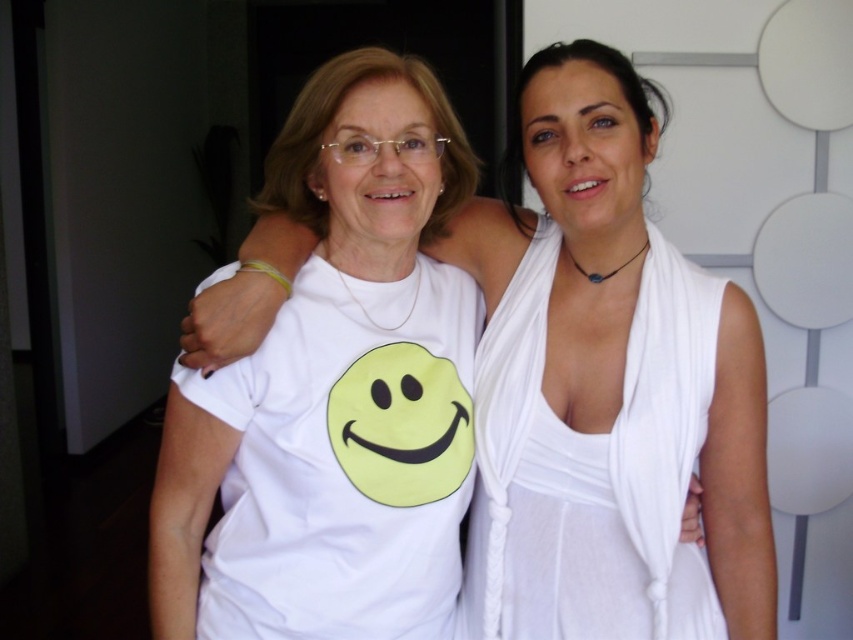
Who is higher up, white fabric dress at center or white silky dress at center?

Positioned higher is white fabric dress at center.

Which is more to the right, white fabric dress at center or white silky dress at center?

From the viewer's perspective, white silky dress at center appears more on the right side.

Who is more distant from viewer, (498,509) or (663,348)?

The point (498,509) is more distant.

Image resolution: width=853 pixels, height=640 pixels. I want to click on white fabric dress at center, so click(614, 360).

Is white silky dress at center further to camera compared to matte white face at center?

That is True.

Who is positioned more to the right, white silky dress at center or matte white face at center?

white silky dress at center is more to the right.

You are a GUI agent. You are given a task and a screenshot of the screen. Output one action in this format:
    pyautogui.click(x=<x>, y=<y>)
    Task: Click on the white silky dress at center
    The image size is (853, 640).
    Given the screenshot: What is the action you would take?
    pyautogui.click(x=590, y=468)

Where is `white silky dress at center`? This screenshot has width=853, height=640. white silky dress at center is located at coordinates (590, 468).

Between point (663, 408) and point (625, 180), which one is positioned behind?

The point (625, 180) is more distant.

Identify the location of white silky dress at center. (590, 468).

Identify the location of white silky dress at center. (590, 468).